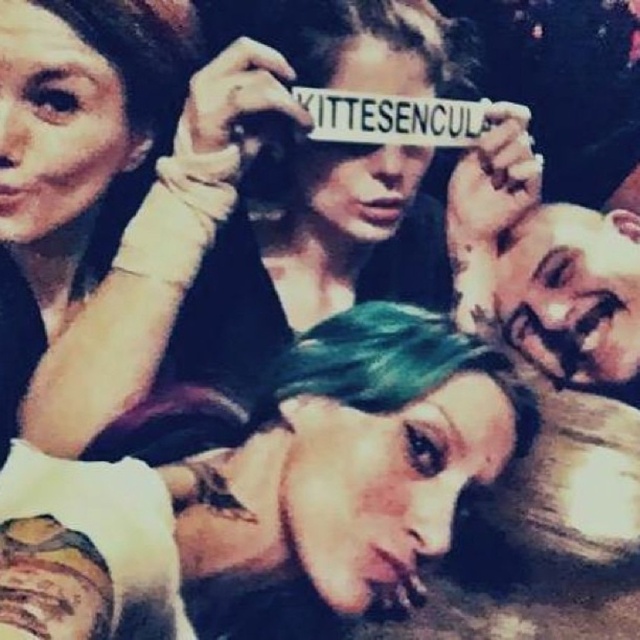
Can you confirm if teal hair at center is positioned above green hair at lower right?

No, teal hair at center is not above green hair at lower right.

Between teal hair at center and green hair at lower right, which one has more height?

green hair at lower right

Is point (435, 384) closer to camera compared to point (563, 346)?

That is True.

At what (x,y) coordinates should I click in order to perform the action: click on teal hair at center. Please return your answer as a coordinate pair (x, y). Looking at the image, I should click on coord(268,484).

Which is more to the left, matte black hair at upper left or green hair at lower right?

matte black hair at upper left

Who is positioned more to the right, matte black hair at upper left or green hair at lower right?

From the viewer's perspective, green hair at lower right appears more on the right side.

Find the location of a particular element. The height and width of the screenshot is (640, 640). matte black hair at upper left is located at coordinates (72, 147).

Where is `matte black hair at upper left`? This screenshot has width=640, height=640. matte black hair at upper left is located at coordinates (72, 147).

Does teal hair at center have a smaller size compared to matte black hair at upper left?

No, teal hair at center is not smaller than matte black hair at upper left.

Measure the distance from teal hair at center to matte black hair at upper left.

teal hair at center is 11.80 inches from matte black hair at upper left.

What do you see at coordinates (268, 484) in the screenshot? I see `teal hair at center` at bounding box center [268, 484].

Where is `teal hair at center`? teal hair at center is located at coordinates (268, 484).